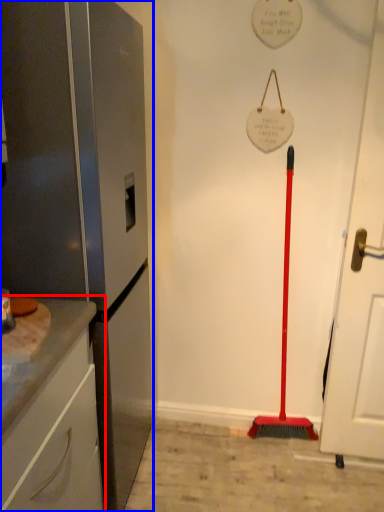
Question: Which object appears closest to the camera in this image, cabinetry (highlighted by a red box) or appliance (highlighted by a blue box)?

Choices:
 (A) cabinetry
 (B) appliance

Answer: (A)